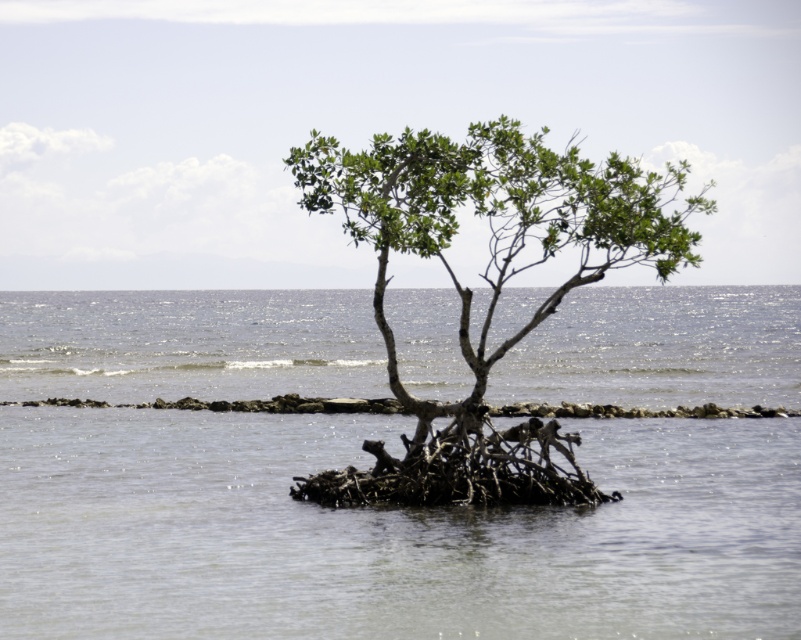
Between green leafy tree at center and brown/rough rock at center, which one appears on the right side from the viewer's perspective?

From the viewer's perspective, green leafy tree at center appears more on the right side.

Who is taller, green leafy tree at center or brown/rough rock at center?

green leafy tree at center

Where is `green leafy tree at center`? This screenshot has height=640, width=801. green leafy tree at center is located at coordinates (494, 221).

Between clear water at center and green leafy tree at center, which one appears on the left side from the viewer's perspective?

green leafy tree at center

The width and height of the screenshot is (801, 640). What do you see at coordinates (385, 532) in the screenshot?
I see `clear water at center` at bounding box center [385, 532].

I want to click on clear water at center, so click(x=385, y=532).

Is brown/root-like at center above brown/rough rock at center?

Actually, brown/root-like at center is below brown/rough rock at center.

Between brown/root-like at center and brown/rough rock at center, which one is positioned lower?

brown/root-like at center

Is point (344, 506) positioned before point (202, 403)?

Yes, point (344, 506) is in front of point (202, 403).

Locate an element on the screen. brown/root-like at center is located at coordinates pos(461,468).